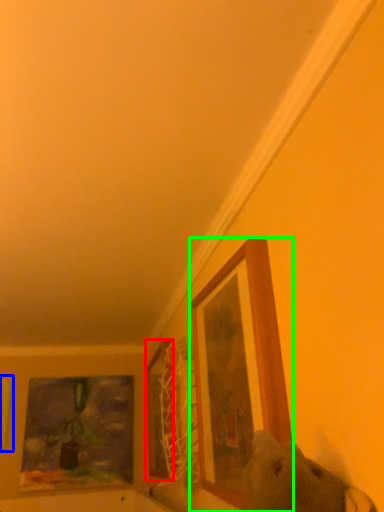
Question: Which object is positioned farthest from picture frame (highlighted by a red box)? Select from picture frame (highlighted by a blue box) and picture frame (highlighted by a green box).

Choices:
 (A) picture frame
 (B) picture frame

Answer: (A)